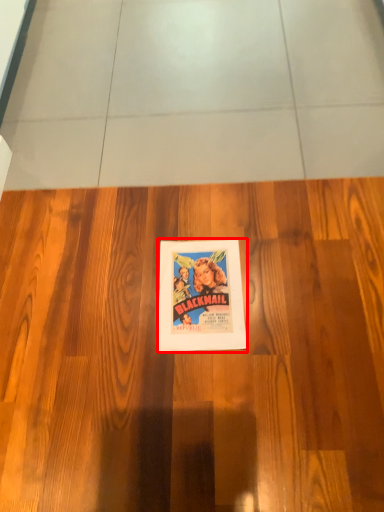
Question: From the image's perspective, what is the correct spatial relationship of poster (annotated by the red box) in relation to hardwood?

Choices:
 (A) above
 (B) below

Answer: (B)